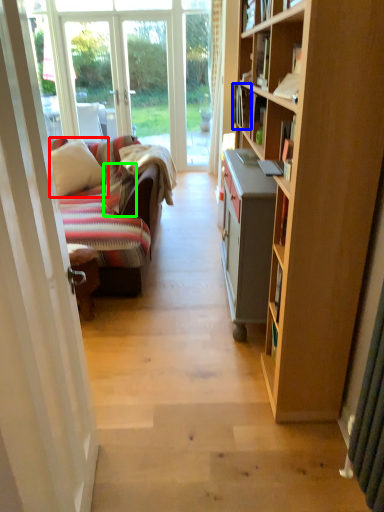
Question: Considering the real-world distances, which object is farthest from pillow (highlighted by a red box)? book (highlighted by a blue box) or pillow (highlighted by a green box)?

Choices:
 (A) book
 (B) pillow

Answer: (A)